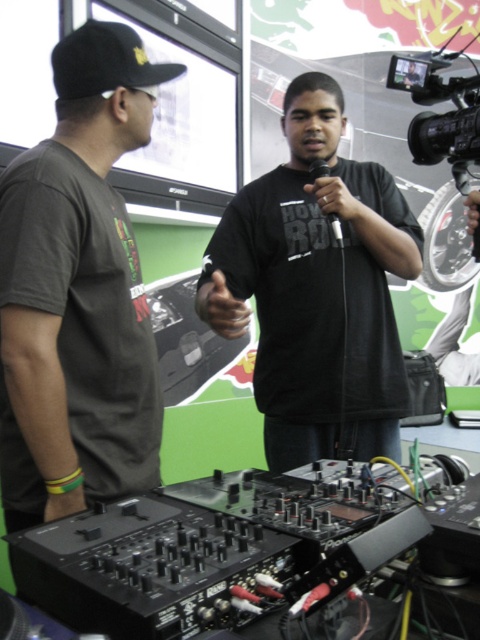
In the scene shown: You are a photographer at the DJ event and want to capture a clear photo of both the black matte shirt at center and the black matte microphone at center. Which object should you focus on first to ensure both are in focus?

The black matte shirt at center is in front of the black matte microphone at center, so you should focus on the black matte shirt at center first to ensure both are in focus.